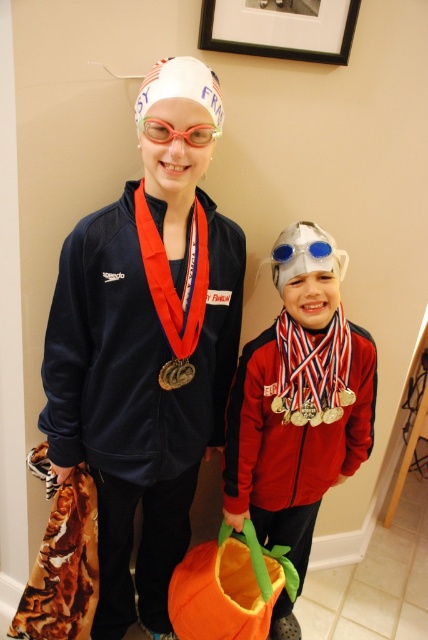
Can you confirm if shiny silver helmet at center is shorter than black matte picture frame at upper center?

No, shiny silver helmet at center is not shorter than black matte picture frame at upper center.

Which is below, shiny silver helmet at center or black matte picture frame at upper center?

shiny silver helmet at center is below.

What do you see at coordinates (299, 404) in the screenshot? I see `shiny silver helmet at center` at bounding box center [299, 404].

Find the location of a particular element. This screenshot has height=640, width=428. shiny silver helmet at center is located at coordinates (299, 404).

Is point (333, 413) farther from camera compared to point (333, 248)?

That is True.

Is point (273, 412) positioned before point (317, 253)?

No, it is behind (317, 253).

You are a GUI agent. You are given a task and a screenshot of the screen. Output one action in this format:
    pyautogui.click(x=<x>, y=<y>)
    Task: Click on the gold metallic medal at lower center
    
    Given the screenshot: What is the action you would take?
    pyautogui.click(x=314, y=406)

Can you confirm if shiny silver helmet at center is smaller than gold metallic medal at center?

No, shiny silver helmet at center is not smaller than gold metallic medal at center.

Which is more to the left, shiny silver helmet at center or gold metallic medal at center?

gold metallic medal at center

The image size is (428, 640). Describe the element at coordinates (299, 404) in the screenshot. I see `shiny silver helmet at center` at that location.

The width and height of the screenshot is (428, 640). Identify the location of shiny silver helmet at center. (299, 404).